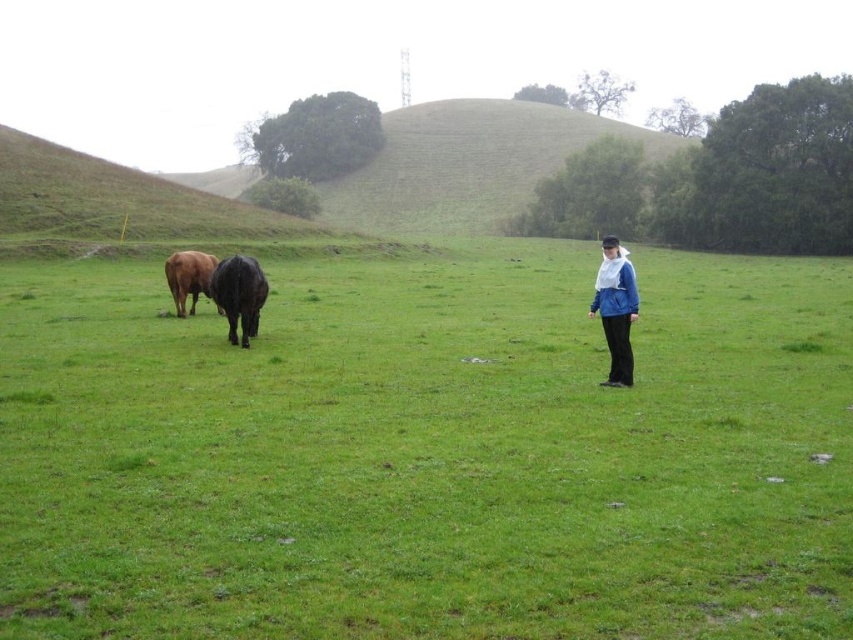
Question: Does black matte cow at center appear over brown matte cow at left?

Choices:
 (A) no
 (B) yes

Answer: (A)

Question: Does green grassy field at center appear under black matte cow at center?

Choices:
 (A) no
 (B) yes

Answer: (A)

Question: Based on their relative distances, which object is nearer to the green grassy field at center?

Choices:
 (A) black matte cow at center
 (B) brown matte cow at left
 (C) blue fabric jacket at right

Answer: (B)

Question: Which object is positioned farthest from the black matte cow at center?

Choices:
 (A) blue fabric jacket at right
 (B) brown matte cow at left
 (C) green grassy field at center

Answer: (C)

Question: Which object is positioned farthest from the black matte cow at center?

Choices:
 (A) green grassy field at center
 (B) blue fabric jacket at right
 (C) brown matte cow at left

Answer: (A)

Question: Is the position of green grassy field at center more distant than that of brown matte cow at left?

Choices:
 (A) yes
 (B) no

Answer: (B)